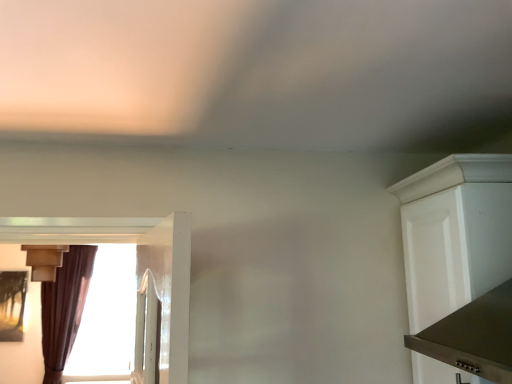
Question: Is white matte cabinet at right inside or outside of matte beige light fixture at left?

Choices:
 (A) inside
 (B) outside

Answer: (B)

Question: From the image's perspective, is white matte cabinet at right above or below matte beige light fixture at left?

Choices:
 (A) above
 (B) below

Answer: (A)

Question: Which object is positioned closest to the white matte cabinet at right?

Choices:
 (A) matte beige light fixture at left
 (B) brown velvet curtain at left

Answer: (A)

Question: Based on their relative distances, which object is nearer to the brown velvet curtain at left?

Choices:
 (A) matte beige light fixture at left
 (B) white matte cabinet at right

Answer: (A)